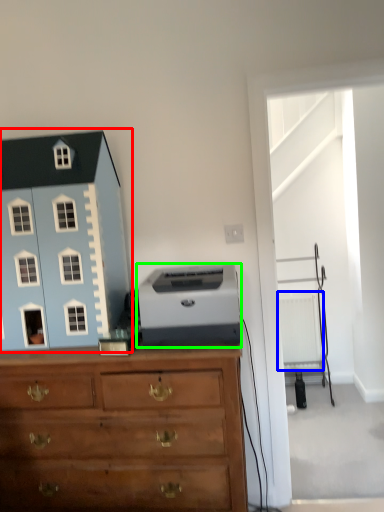
Question: Based on their relative distances, which object is nearer to toy (highlighted by a red box)? Choose from radiator (highlighted by a blue box) and printer (highlighted by a green box).

Choices:
 (A) radiator
 (B) printer

Answer: (B)